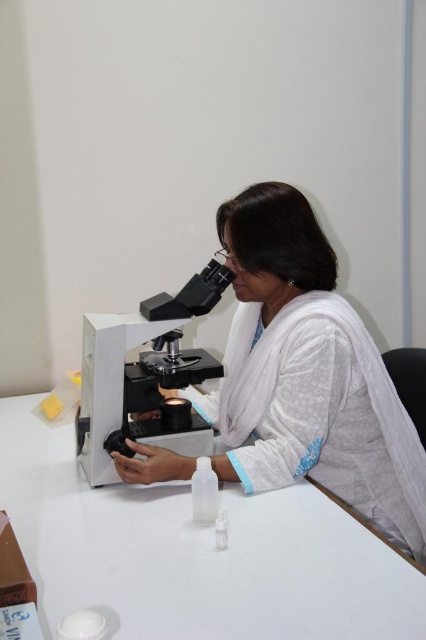
Based on the photo, does white matte/soft fabric at center lie behind white plastic microscope at center?

No, white matte/soft fabric at center is closer to the viewer.

Can you confirm if white matte/soft fabric at center is wider than white plastic microscope at center?

Correct, the width of white matte/soft fabric at center exceeds that of white plastic microscope at center.

Describe the element at coordinates (307, 374) in the screenshot. I see `white matte/soft fabric at center` at that location.

At what (x,y) coordinates should I click in order to perform the action: click on white matte/soft fabric at center. Please return your answer as a coordinate pair (x, y). Image resolution: width=426 pixels, height=640 pixels. Looking at the image, I should click on (307, 374).

Can you confirm if white plastic table at center is positioned to the right of white plastic microscope at center?

In fact, white plastic table at center is to the left of white plastic microscope at center.

Does point (354, 564) lie in front of point (175, 385)?

That is True.

Locate an element on the screen. The width and height of the screenshot is (426, 640). white plastic table at center is located at coordinates (195, 554).

What do you see at coordinates (195, 554) in the screenshot? I see `white plastic table at center` at bounding box center [195, 554].

Between white plastic table at center and white matte/soft fabric at center, which one appears on the right side from the viewer's perspective?

white matte/soft fabric at center

Who is more forward, (81, 541) or (276, 301)?

Positioned in front is point (81, 541).

This screenshot has width=426, height=640. What are the coordinates of `white plastic table at center` in the screenshot? It's located at (195, 554).